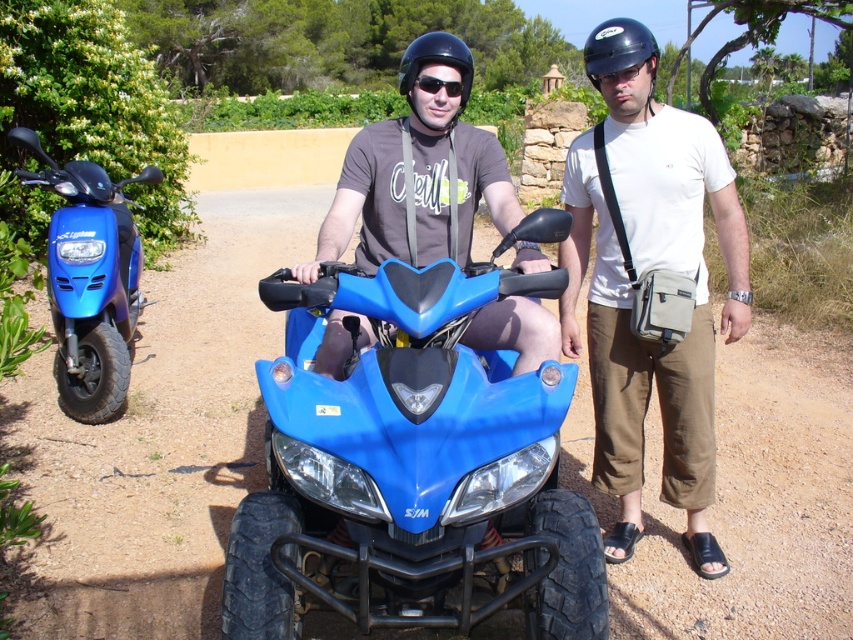
Is point (589, 40) less distant than point (405, 54)?

No, (589, 40) is behind (405, 54).

Which is below, black matte helmet at upper center or black matte helmet at center?

Positioned lower is black matte helmet at center.

Image resolution: width=853 pixels, height=640 pixels. What are the coordinates of `black matte helmet at upper center` in the screenshot? It's located at (618, 48).

Between blue glossy quad bike at center and transparent plastic goggles at center, which one has less height?

transparent plastic goggles at center

Between point (595, 566) and point (624, 76), which one is positioned behind?

The point (624, 76) is more distant.

This screenshot has width=853, height=640. I want to click on blue glossy quad bike at center, so click(x=413, y=464).

Does white matte shirt at center appear over matte black goggles at center?

Incorrect, white matte shirt at center is not positioned above matte black goggles at center.

Is white matte shirt at center closer to the viewer compared to matte black goggles at center?

→ No, white matte shirt at center is further to the viewer.

Which is in front, point (643, 275) or point (433, 92)?

Positioned in front is point (433, 92).

You are a GUI agent. You are given a task and a screenshot of the screen. Output one action in this format:
    pyautogui.click(x=<x>, y=<y>)
    Task: Click on the white matte shirt at center
    The width and height of the screenshot is (853, 640).
    Given the screenshot: What is the action you would take?
    pyautogui.click(x=650, y=300)